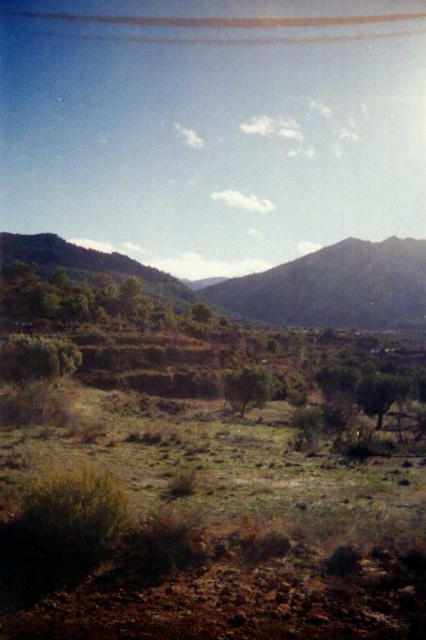
Question: Among these objects, which one is nearest to the camera?

Choices:
 (A) green leafy tree at center
 (B) green grassy mountain at center

Answer: (A)

Question: Is green leafy tree at lower left bigger than green leafy tree at center?

Choices:
 (A) no
 (B) yes

Answer: (B)

Question: Can you confirm if green grassy mountain at center is thinner than green leafy tree at lower left?

Choices:
 (A) no
 (B) yes

Answer: (A)

Question: Which point appears closest to the camera in this image?

Choices:
 (A) (412, 275)
 (B) (14, 365)

Answer: (B)

Question: Does green grassy mountain at center appear on the right side of green leafy tree at center?

Choices:
 (A) yes
 (B) no

Answer: (A)

Question: Which point is farther from the camera taking this photo?

Choices:
 (A) (247, 408)
 (B) (397, 401)

Answer: (A)